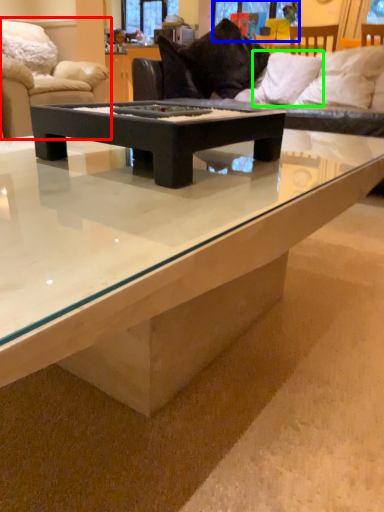
Question: Which is nearer to the studio couch (highlighted by a red box)? window screen (highlighted by a blue box) or pillow (highlighted by a green box).

Choices:
 (A) window screen
 (B) pillow

Answer: (B)